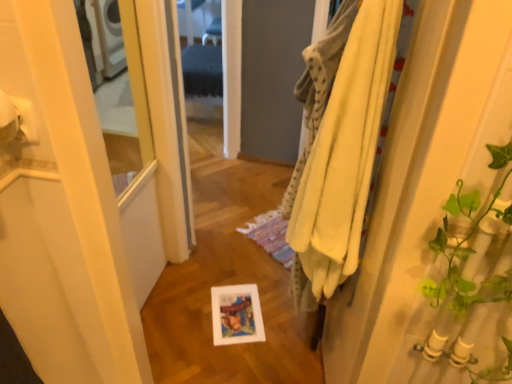
In order to face yellow cotton bath towel at right, the 2th bath towel when ordered from bottom to top, should I rotate leftwards or rightwards?

It's best to rotate right around 7.003 degrees.

Measure the distance between point (x=435, y=27) and camera.

The depth of point (x=435, y=27) is 27.56 inches.

Describe the element at coordinates (16, 118) in the screenshot. I see `white matte toilet paper at upper left` at that location.

At what (x,y) coordinates should I click in order to perform the action: click on yellow cotton bath towel at right, the 2th bath towel when ordered from bottom to top. Please return your answer as a coordinate pair (x, y). Looking at the image, I should click on (319, 86).

Can you confirm if white matte toilet paper at upper left is taller than yellow fabric at right?

Incorrect, the height of white matte toilet paper at upper left is not larger of that of yellow fabric at right.

Is white matte toilet paper at upper left oriented towards yellow fabric at right?

No, white matte toilet paper at upper left is not turned towards yellow fabric at right.

The height and width of the screenshot is (384, 512). Identify the location of toilet paper located on the left of yellow fabric at right. click(x=16, y=118).

Is white matte toilet paper at upper left at the right side of yellow fabric at right?

Incorrect, white matte toilet paper at upper left is not on the right side of yellow fabric at right.

From a real-world perspective, who is located higher, yellow soft towel at right, the 1th bath towel ordered from the bottom, or white matte toilet paper at upper left?

white matte toilet paper at upper left is physically above.

Does point (298, 86) appear closer or farther from the camera than point (2, 137)?

Point (298, 86).

In the scene shown: Do you think yellow soft towel at right, acting as the second bath towel starting from the top, is within white matte toilet paper at upper left, or outside of it?

yellow soft towel at right, acting as the second bath towel starting from the top, is located beyond the bounds of white matte toilet paper at upper left.

Is yellow soft towel at right, the 1th bath towel ordered from the bottom, not close to white matte toilet paper at upper left?

No.

Can yellow cotton bath towel at right, the 2th bath towel when ordered from bottom to top, be found inside yellow soft towel at right, the 1th bath towel ordered from the bottom?

No, yellow soft towel at right, the 1th bath towel ordered from the bottom, does not contain yellow cotton bath towel at right, the 2th bath towel when ordered from bottom to top.

Considering the relative sizes of yellow soft towel at right, acting as the second bath towel starting from the top, and yellow cotton bath towel at right, the 1th bath towel when ordered from top to bottom, in the image provided, is yellow soft towel at right, acting as the second bath towel starting from the top, smaller than yellow cotton bath towel at right, the 1th bath towel when ordered from top to bottom,?

Yes.

Measure the distance between yellow soft towel at right, the 1th bath towel ordered from the bottom, and yellow cotton bath towel at right, the 2th bath towel when ordered from bottom to top.

yellow soft towel at right, the 1th bath towel ordered from the bottom, and yellow cotton bath towel at right, the 2th bath towel when ordered from bottom to top, are 2.91 inches apart from each other.

You are a GUI agent. You are given a task and a screenshot of the screen. Output one action in this format:
    pyautogui.click(x=<x>, y=<y>)
    Task: Click on the bath towel on the left of yellow soft towel at right, the 1th bath towel ordered from the bottom
    
    Given the screenshot: What is the action you would take?
    pyautogui.click(x=319, y=86)

Could you tell me if white matte toilet paper at upper left is facing yellow soft towel at right, the 1th bath towel ordered from the bottom?

No, white matte toilet paper at upper left is not oriented towards yellow soft towel at right, the 1th bath towel ordered from the bottom.

Is white matte toilet paper at upper left wider than yellow soft towel at right, acting as the second bath towel starting from the top?

Incorrect, the width of white matte toilet paper at upper left does not surpass that of yellow soft towel at right, acting as the second bath towel starting from the top.

Which is correct: white matte toilet paper at upper left is inside yellow soft towel at right, the 1th bath towel ordered from the bottom, or outside of it?

white matte toilet paper at upper left is not enclosed by yellow soft towel at right, the 1th bath towel ordered from the bottom.

Starting from the white matte toilet paper at upper left, which bath towel is the 1st one behind? Please provide its 2D coordinates.

[(338, 144)]

How different are the orientations of yellow cotton bath towel at right, the 1th bath towel when ordered from top to bottom, and yellow fabric at right in degrees?

yellow cotton bath towel at right, the 1th bath towel when ordered from top to bottom, and yellow fabric at right are facing 0.435 degrees away from each other.

Is yellow cotton bath towel at right, the 1th bath towel when ordered from top to bottom, oriented towards yellow fabric at right?

No.

Between yellow cotton bath towel at right, the 1th bath towel when ordered from top to bottom, and yellow fabric at right, which one is positioned in front?

yellow fabric at right is closer to the camera.

Considering the relative positions of yellow cotton bath towel at right, the 2th bath towel when ordered from bottom to top, and yellow fabric at right in the image provided, is yellow cotton bath towel at right, the 2th bath towel when ordered from bottom to top, to the left of yellow fabric at right from the viewer's perspective?

Yes.

From a real-world perspective, is yellow cotton bath towel at right, the 1th bath towel when ordered from top to bottom, physically located above or below yellow soft towel at right, acting as the second bath towel starting from the top?

yellow cotton bath towel at right, the 1th bath towel when ordered from top to bottom, is situated higher than yellow soft towel at right, acting as the second bath towel starting from the top, in the real world.

Is yellow cotton bath towel at right, the 1th bath towel when ordered from top to bottom, positioned with its back to yellow soft towel at right, acting as the second bath towel starting from the top?

yellow cotton bath towel at right, the 1th bath towel when ordered from top to bottom, does not have its back to yellow soft towel at right, acting as the second bath towel starting from the top.

Can you see yellow cotton bath towel at right, the 2th bath towel when ordered from bottom to top, touching yellow soft towel at right, the 1th bath towel ordered from the bottom?

Yes, yellow cotton bath towel at right, the 2th bath towel when ordered from bottom to top, is touching yellow soft towel at right, the 1th bath towel ordered from the bottom.

This screenshot has height=384, width=512. Identify the location of bath towel behind the yellow soft towel at right, the 1th bath towel ordered from the bottom. (319, 86).

From the image's perspective, which object appears higher, yellow fabric at right or yellow cotton bath towel at right, the 2th bath towel when ordered from bottom to top?

yellow cotton bath towel at right, the 2th bath towel when ordered from bottom to top, from the image's perspective.

Which of these two, yellow fabric at right or yellow cotton bath towel at right, the 2th bath towel when ordered from bottom to top, is smaller?

With smaller size is yellow cotton bath towel at right, the 2th bath towel when ordered from bottom to top.

Which is closer to the camera, (442, 2) or (319, 81)?

Point (442, 2) is closer to the camera than point (319, 81).

Locate an element on the screen. door in front of the yellow cotton bath towel at right, the 2th bath towel when ordered from bottom to top is located at coordinates (436, 212).

Find the location of `door on the right of the white matte toilet paper at upper left`. door on the right of the white matte toilet paper at upper left is located at coordinates (436, 212).

Where is `toilet paper lying in front of the yellow soft towel at right, the 1th bath towel ordered from the bottom`? toilet paper lying in front of the yellow soft towel at right, the 1th bath towel ordered from the bottom is located at coordinates 16,118.

Looking at the image, which one is located further to yellow soft towel at right, the 1th bath towel ordered from the bottom, yellow fabric at right or yellow cotton bath towel at right, the 2th bath towel when ordered from bottom to top?

Among the two, yellow fabric at right is located further to yellow soft towel at right, the 1th bath towel ordered from the bottom.

From the image, which object appears to be farther from yellow cotton bath towel at right, the 1th bath towel when ordered from top to bottom, yellow soft towel at right, the 1th bath towel ordered from the bottom, or white matte toilet paper at upper left?

Based on the image, white matte toilet paper at upper left appears to be further to yellow cotton bath towel at right, the 1th bath towel when ordered from top to bottom.

Considering their positions, is yellow fabric at right positioned closer to white matte toilet paper at upper left than yellow cotton bath towel at right, the 1th bath towel when ordered from top to bottom?

yellow cotton bath towel at right, the 1th bath towel when ordered from top to bottom, is positioned closer to the anchor white matte toilet paper at upper left.

When comparing their distances from yellow soft towel at right, acting as the second bath towel starting from the top, does yellow fabric at right or white matte toilet paper at upper left seem closer?

yellow fabric at right lies closer to yellow soft towel at right, acting as the second bath towel starting from the top, than the other object.

Which object lies nearer to the anchor point yellow fabric at right, yellow cotton bath towel at right, the 1th bath towel when ordered from top to bottom, or yellow soft towel at right, acting as the second bath towel starting from the top?

yellow soft towel at right, acting as the second bath towel starting from the top.

Looking at the image, which one is located closer to yellow fabric at right, yellow soft towel at right, acting as the second bath towel starting from the top, or white matte toilet paper at upper left?

yellow soft towel at right, acting as the second bath towel starting from the top.

Considering their positions, is white matte toilet paper at upper left positioned closer to yellow cotton bath towel at right, the 2th bath towel when ordered from bottom to top, than yellow fabric at right?

Among the two, yellow fabric at right is located nearer to yellow cotton bath towel at right, the 2th bath towel when ordered from bottom to top.

When comparing their distances from white matte toilet paper at upper left, does yellow cotton bath towel at right, the 2th bath towel when ordered from bottom to top, or yellow soft towel at right, the 1th bath towel ordered from the bottom, seem further?

yellow cotton bath towel at right, the 2th bath towel when ordered from bottom to top, is further to white matte toilet paper at upper left.

I want to click on bath towel between white matte toilet paper at upper left and yellow soft towel at right, acting as the second bath towel starting from the top, so click(x=319, y=86).

You are a GUI agent. You are given a task and a screenshot of the screen. Output one action in this format:
    pyautogui.click(x=<x>, y=<y>)
    Task: Click on the bath towel that lies between yellow cotton bath towel at right, the 1th bath towel when ordered from top to bottom, and yellow fabric at right from top to bottom
    
    Given the screenshot: What is the action you would take?
    pyautogui.click(x=338, y=144)